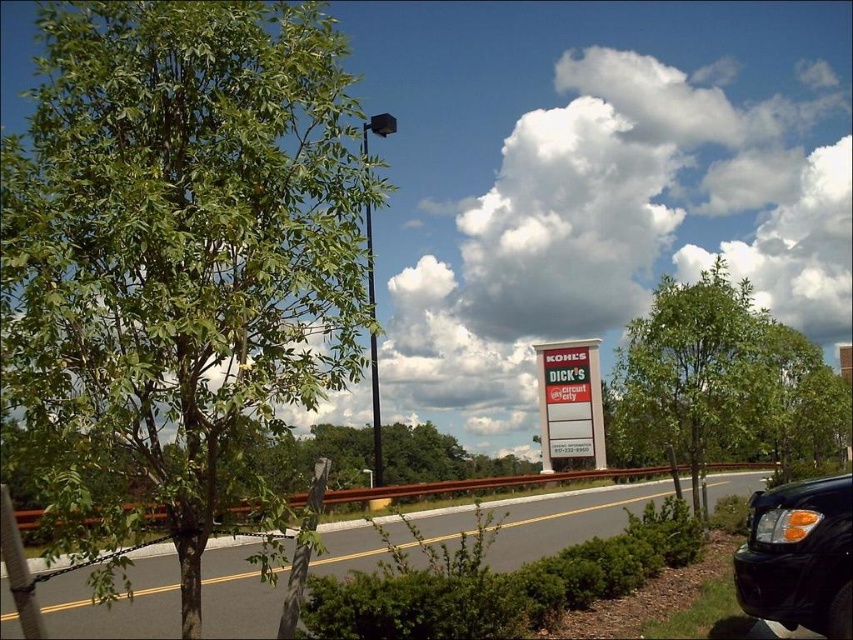
Question: Which object appears closest to the camera in this image?

Choices:
 (A) green leafy tree at center
 (B) asphalt road at center
 (C) red plastic sign at center

Answer: (B)

Question: Is asphalt road at center bigger than green leafy tree at center?

Choices:
 (A) no
 (B) yes

Answer: (B)

Question: Which of these objects is positioned closest to the asphalt road at center?

Choices:
 (A) green leafy tree at left
 (B) red plastic sign at center
 (C) green leafy tree at center
 (D) black matte truck at lower right

Answer: (C)

Question: Does green leafy tree at left have a lesser width compared to asphalt road at center?

Choices:
 (A) yes
 (B) no

Answer: (A)

Question: Considering the real-world distances, which object is farthest from the red plastic sign at center?

Choices:
 (A) black matte truck at lower right
 (B) green leafy tree at left
 (C) asphalt road at center
 (D) green leafy tree at center

Answer: (B)

Question: Does green leafy tree at left appear on the left side of green leafy tree at center?

Choices:
 (A) yes
 (B) no

Answer: (A)